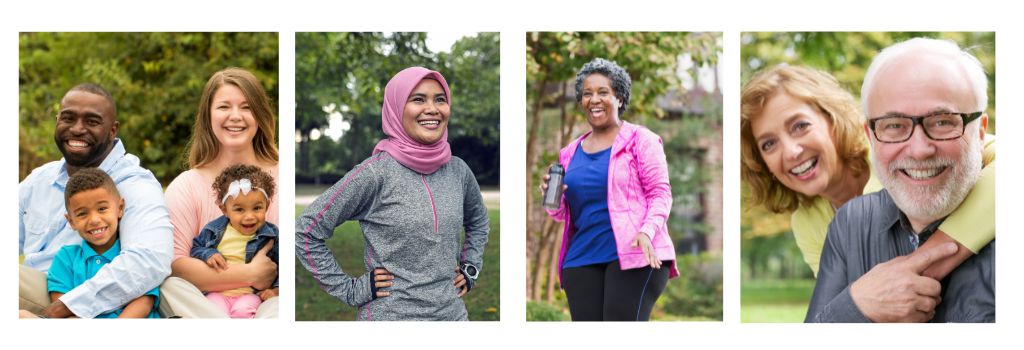
Find the location of a particular element. This screenshot has height=350, width=1024. pictures is located at coordinates (187, 167), (359, 175), (563, 174), (865, 148).